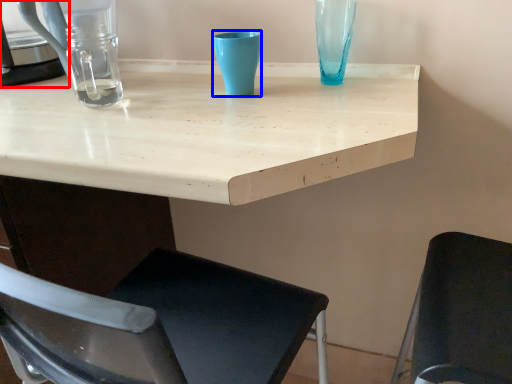
Question: Which object is closer to the camera taking this photo, appliance (highlighted by a red box) or turquoise (highlighted by a blue box)?

Choices:
 (A) appliance
 (B) turquoise

Answer: (B)